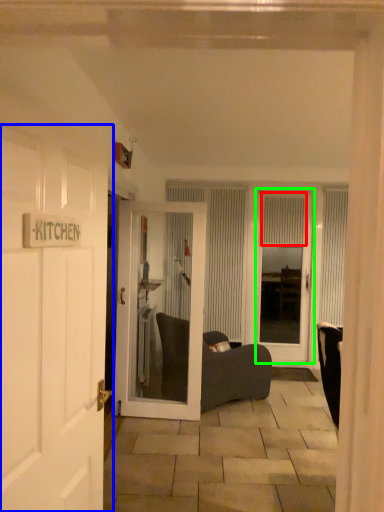
Question: Considering the real-world distances, which object is farthest from curtain (highlighted by a red box)? door (highlighted by a blue box) or door (highlighted by a green box)?

Choices:
 (A) door
 (B) door

Answer: (A)